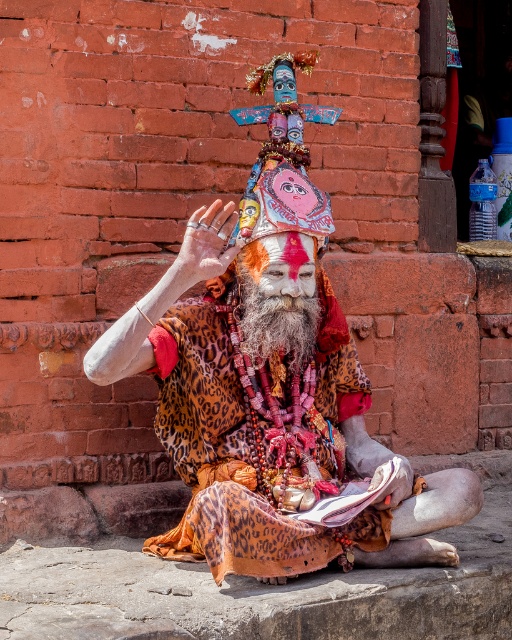
Is leopard print cloth at center smaller than grayleopard printbeard at center?

Incorrect, leopard print cloth at center is not smaller in size than grayleopard printbeard at center.

Which of these two, leopard print cloth at center or grayleopard printbeard at center, stands shorter?

grayleopard printbeard at center is shorter.

Which is behind, point (266, 157) or point (288, 296)?

Point (266, 157)

Where is `leopard print cloth at center`? leopard print cloth at center is located at coordinates (271, 397).